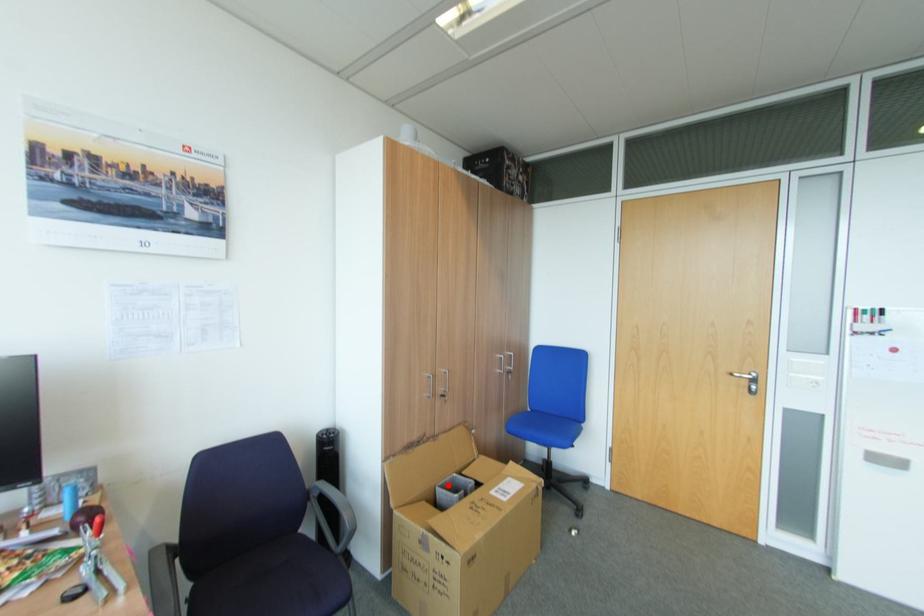
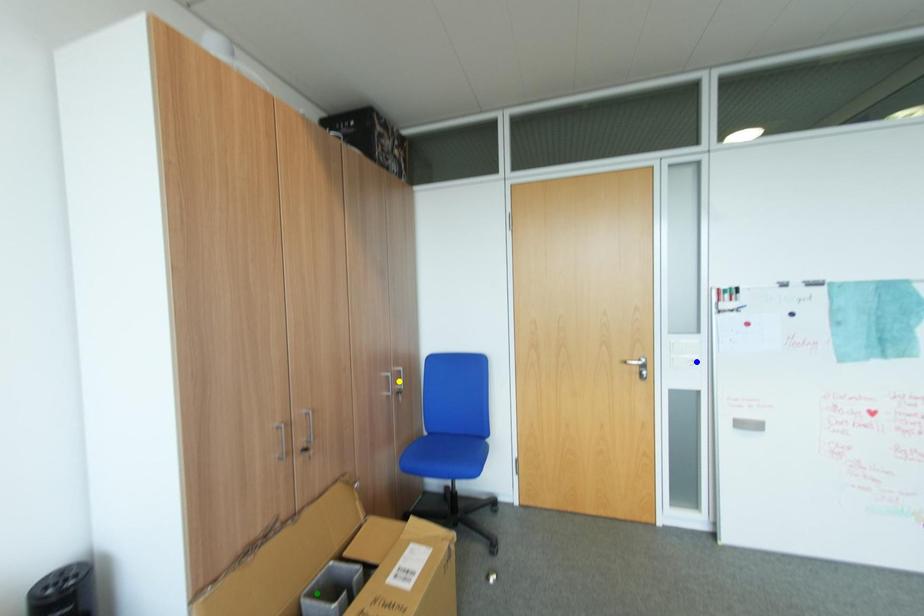
Question: I am providing you with two images of the same scene from different viewpoints. A red point is marked on the first image. You are given multiple points on the second image. Can you choose the point in image 2 that corresponds to the point in image 1?

Choices:
 (A) green point
 (B) blue point
 (C) yellow point

Answer: (A)